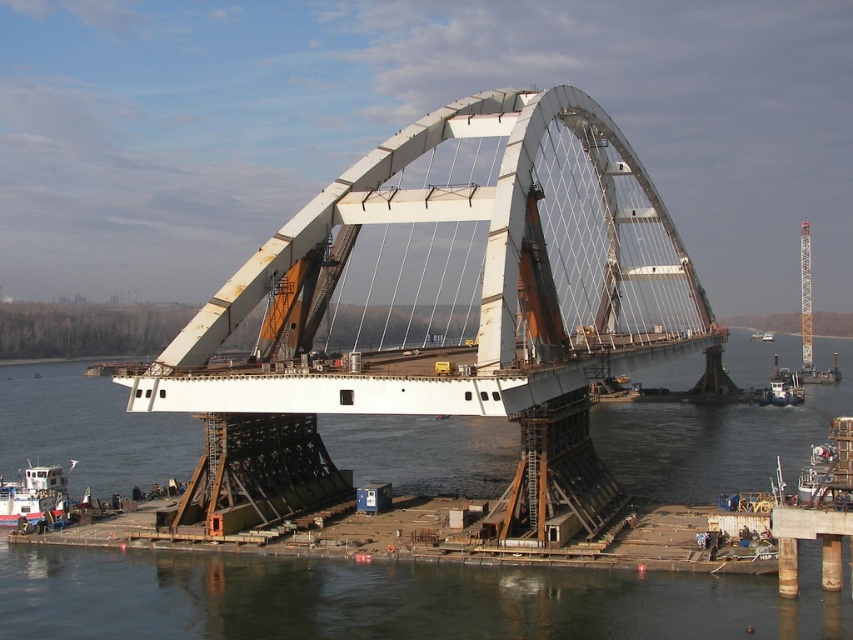
Question: Can you confirm if white metallic crane at right is smaller than white matte boat at lower right?

Choices:
 (A) no
 (B) yes

Answer: (A)

Question: Based on their relative distances, which object is farther from the white metallic arch bridge at center?

Choices:
 (A) dark gray water at center
 (B) blue painted steel boat at lower left

Answer: (B)

Question: Is dark gray water at center smaller than white metallic crane at right?

Choices:
 (A) no
 (B) yes

Answer: (A)

Question: Is dark gray water at center positioned before white matte boat at lower right?

Choices:
 (A) no
 (B) yes

Answer: (B)

Question: Among these points, which one is nearest to the camera?

Choices:
 (A) (10, 525)
 (B) (770, 388)

Answer: (A)

Question: Which object is positioned closest to the dark gray water at center?

Choices:
 (A) white metallic arch bridge at center
 (B) white metallic crane at right
 (C) white matte boat at lower right
 (D) blue painted steel boat at lower left

Answer: (A)